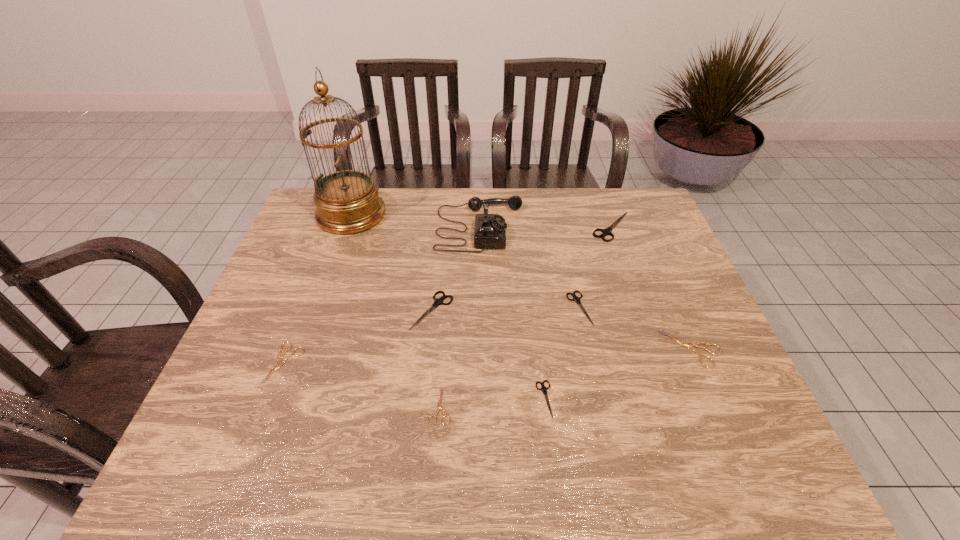
In order to click on free spot located 0.140m on the front of the third black shears from left to right in this screenshot , I will do pyautogui.click(x=593, y=373).

This screenshot has width=960, height=540. Identify the location of vacant space located on the left of the rightmost beige shears. point(505,348).

Find the location of a particular element. Image resolution: width=960 pixels, height=540 pixels. vacant space situated on the right of the leftmost shears is located at coordinates (420, 363).

Image resolution: width=960 pixels, height=540 pixels. What are the coordinates of `free region located on the right of the second black shears from left to right` in the screenshot? It's located at (607, 399).

You are a GUI agent. You are given a task and a screenshot of the screen. Output one action in this format:
    pyautogui.click(x=<x>, y=<y>)
    Task: Click on the free space located 0.090m on the left of the nearest beige shears
    The width and height of the screenshot is (960, 540).
    Given the screenshot: What is the action you would take?
    pyautogui.click(x=388, y=406)

Where is `birdcage at the far edge`? The height and width of the screenshot is (540, 960). birdcage at the far edge is located at coordinates (347, 201).

Identify the location of telephone at the far edge. (489, 229).

Find the location of a particular element. This screenshot has width=960, height=540. shears that is at the far edge is located at coordinates (607, 231).

You are a GUI agent. You are given a task and a screenshot of the screen. Output one action in this format:
    pyautogui.click(x=<x>, y=<y>)
    Task: Click on the birdcage present at the left edge
    
    Given the screenshot: What is the action you would take?
    [347, 201]

Locate an element on the screen. The height and width of the screenshot is (540, 960). shears that is at the left edge is located at coordinates (279, 357).